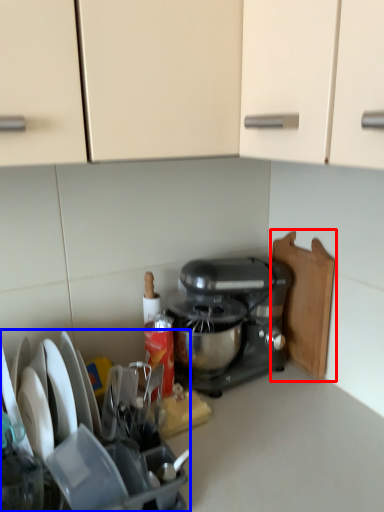
Question: Which point is closer to the camera, cutting board (highlighted by a red box) or appliance (highlighted by a blue box)?

Choices:
 (A) cutting board
 (B) appliance

Answer: (B)